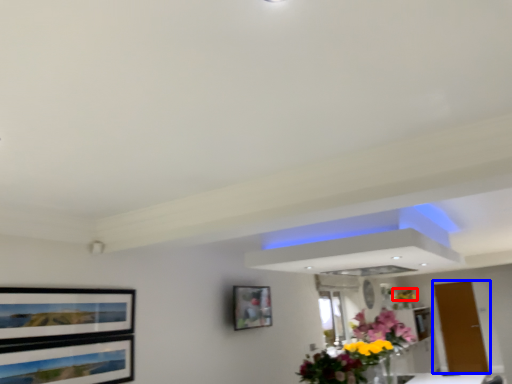
Question: Which point is closer to the camera, flower (highlighted by a red box) or door (highlighted by a blue box)?

Choices:
 (A) flower
 (B) door

Answer: (B)